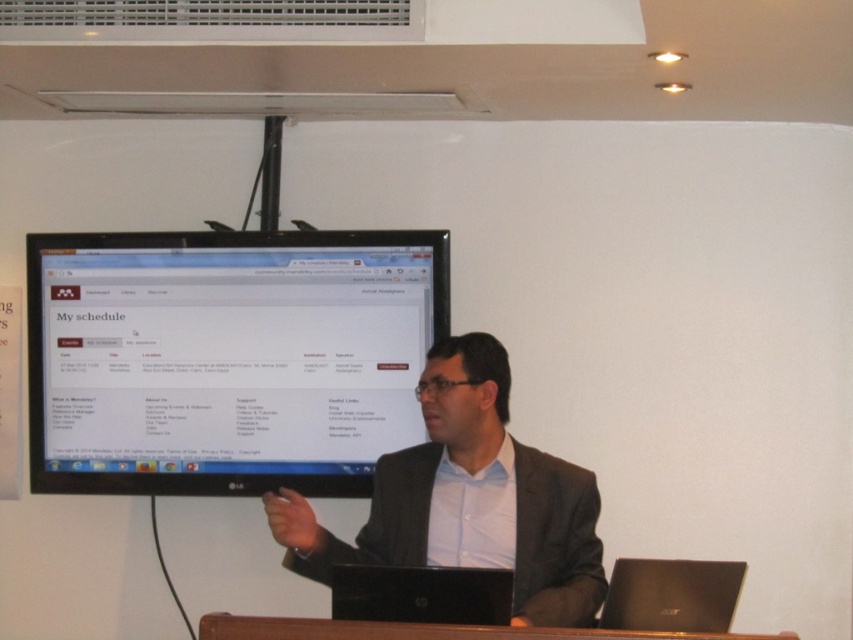
You are an attendee in the conference room and want to look at the black glossy monitor at upper center. Where should you position yourself to see it clearly?

The black glossy monitor at upper center is located at point (227,356), so you should position yourself directly in front of it to have a clear view.

You are a presenter who needs to display a presentation on both the black glossy monitor at upper center and the black matte laptop at lower right. Which device should you use if you want to show a taller presentation?

The black glossy monitor at upper center is taller than the black matte laptop at lower right, so you should use the black glossy monitor at upper center to show a taller presentation.